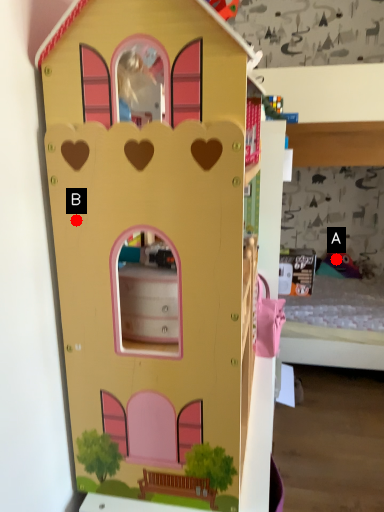
Question: Two points are circled on the image, labeled by A and B beside each circle. Which point is closer to the camera?

Choices:
 (A) A is closer
 (B) B is closer

Answer: (B)